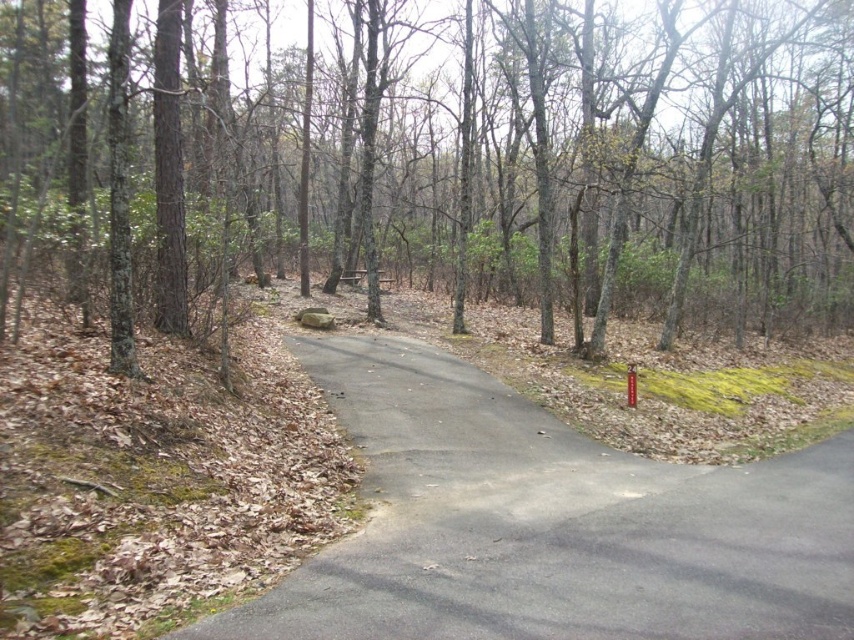
Who is positioned more to the left, brown bark tree at center or gray asphalt road at center?

From the viewer's perspective, brown bark tree at center appears more on the left side.

Consider the image. Who is more forward, (203,93) or (457,433)?

Positioned in front is point (457,433).

Which is behind, point (635, 208) or point (442, 477)?

The point (635, 208) is more distant.

Locate an element on the screen. The height and width of the screenshot is (640, 854). brown bark tree at center is located at coordinates (500, 160).